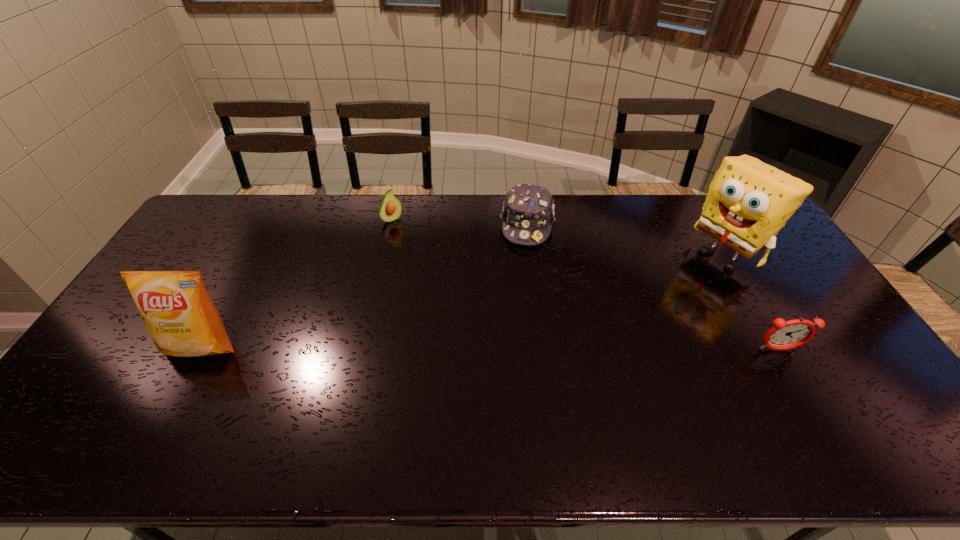
Identify the location of vacant space located 0.140m on the cut side of the second object from left to right. (417, 246).

I want to click on free space located on the face of the sponge, so click(x=624, y=319).

I want to click on free space located 0.290m on the face of the sponge, so click(x=643, y=307).

Where is `vacant space located 0.330m on the face of the sponge`? This screenshot has width=960, height=540. vacant space located 0.330m on the face of the sponge is located at coordinates (634, 313).

Image resolution: width=960 pixels, height=540 pixels. Identify the location of vacant space located on the front-facing side of the headwear. (523, 267).

Locate an element on the screen. This screenshot has width=960, height=540. vacant region located 0.140m on the front-facing side of the headwear is located at coordinates (522, 276).

I want to click on free space located 0.110m on the front-facing side of the headwear, so click(523, 269).

Locate an element on the screen. avocado present at the far edge is located at coordinates (390, 208).

Find the location of a particular element. This screenshot has height=540, width=960. sponge at the far edge is located at coordinates (748, 202).

Where is `headwear positioned at the far edge`? headwear positioned at the far edge is located at coordinates (528, 212).